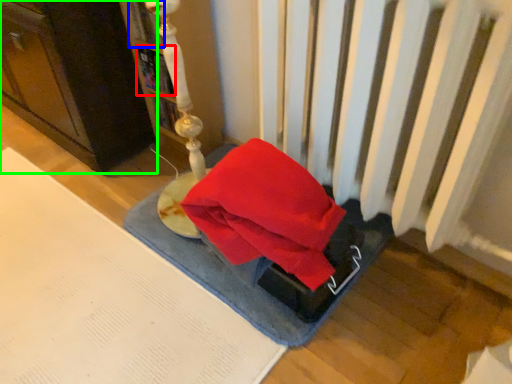
Question: Which is farther away from book (highlighted by a red box)? book (highlighted by a blue box) or furniture (highlighted by a green box)?

Choices:
 (A) book
 (B) furniture

Answer: (B)